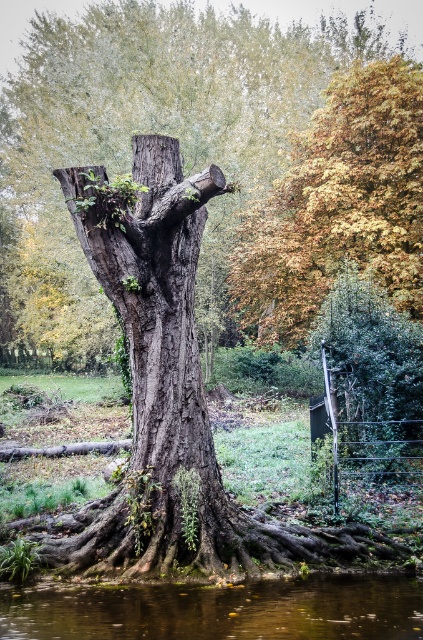
Question: Which object appears farthest from the camera in this image?

Choices:
 (A) brown reflective water at lower center
 (B) yellow-green foliage at upper right

Answer: (B)

Question: Is gray rough bark tree trunk at center to the right of yellow-green foliage at upper right from the viewer's perspective?

Choices:
 (A) no
 (B) yes

Answer: (A)

Question: Considering the relative positions of gray rough bark tree trunk at center and yellow-green foliage at upper right in the image provided, where is gray rough bark tree trunk at center located with respect to yellow-green foliage at upper right?

Choices:
 (A) left
 (B) right

Answer: (A)

Question: Which object is positioned farthest from the gray rough bark tree trunk at center?

Choices:
 (A) yellow-green foliage at upper right
 (B) brown reflective water at lower center

Answer: (B)

Question: Which point appears farthest from the camera in this image?

Choices:
 (A) (321, 246)
 (B) (164, 35)

Answer: (B)

Question: Is gray rough bark tree trunk at center wider than brown reflective water at lower center?

Choices:
 (A) no
 (B) yes

Answer: (B)